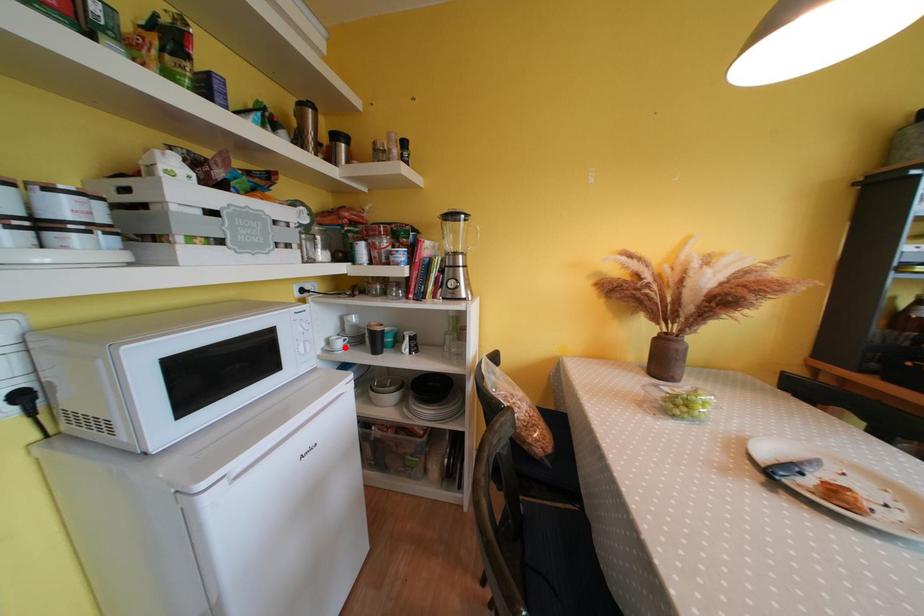
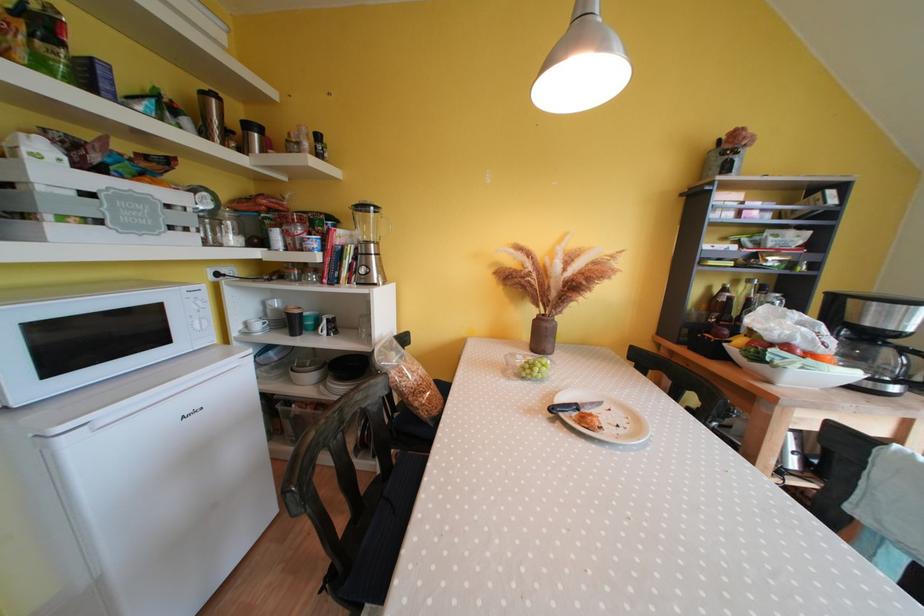
Find the pixel in the second image that matches the highlighted location in the first image.

(264, 330)